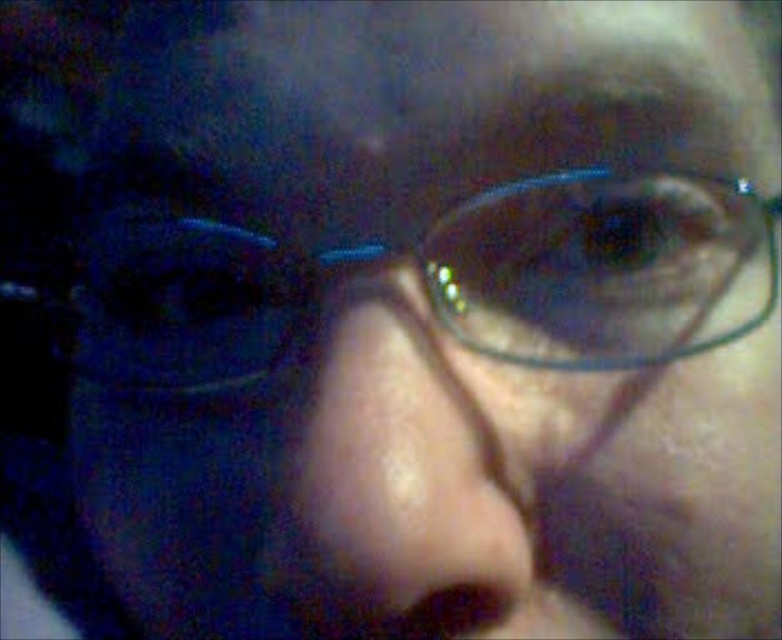
Is clear plastic glasses at center wider than smooth skin nose at center?

Correct, the width of clear plastic glasses at center exceeds that of smooth skin nose at center.

Describe the element at coordinates (601, 268) in the screenshot. The width and height of the screenshot is (782, 640). I see `clear plastic glasses at center` at that location.

Does point (481, 342) lie behind point (510, 572)?

That is True.

I want to click on clear plastic glasses at center, so click(601, 268).